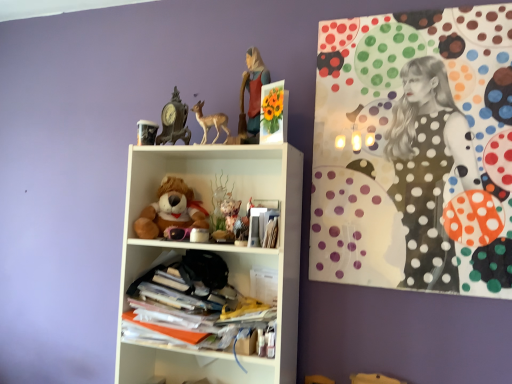
Question: Is point (152, 190) closer or farther from the camera than point (179, 94)?

Choices:
 (A) closer
 (B) farther

Answer: (B)

Question: In the image, is white matte shelf at center, placed as the 2th shelf when sorted from bottom to top, on the left side or the right side of antique bronze clock at upper center?

Choices:
 (A) right
 (B) left

Answer: (A)

Question: Based on their relative distances, which object is nearer to the polka dot canvas at upper right?

Choices:
 (A) stacked papers at center, which is the 1th shelf in bottom-to-top order
 (B) antique bronze clock at upper center
 (C) white matte shelf at center, placed as the 2th shelf when sorted from bottom to top
 (D) matte plastic figurine at upper center
 (E) matte brown deer at upper center

Answer: (C)

Question: Which is nearer to the matte brown deer at upper center?

Choices:
 (A) matte plastic figurine at upper center
 (B) antique bronze clock at upper center
 (C) soft plush teddy bear at center
 (D) polka dot canvas at upper right
 (E) white matte shelf at center, placed as the 2th shelf when sorted from bottom to top

Answer: (B)